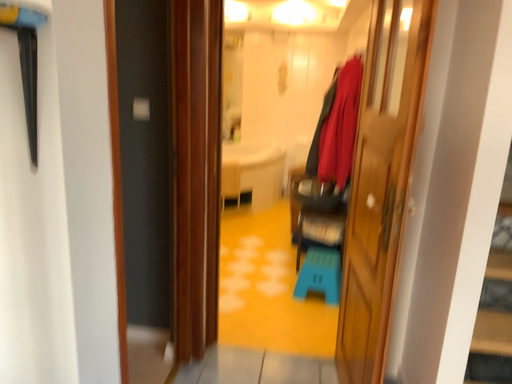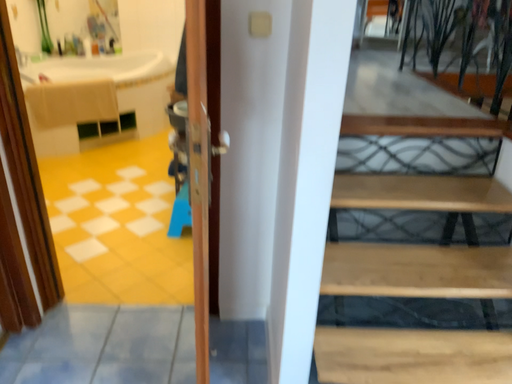
Question: How did the camera likely rotate when shooting the video?

Choices:
 (A) rotated right
 (B) rotated left

Answer: (A)